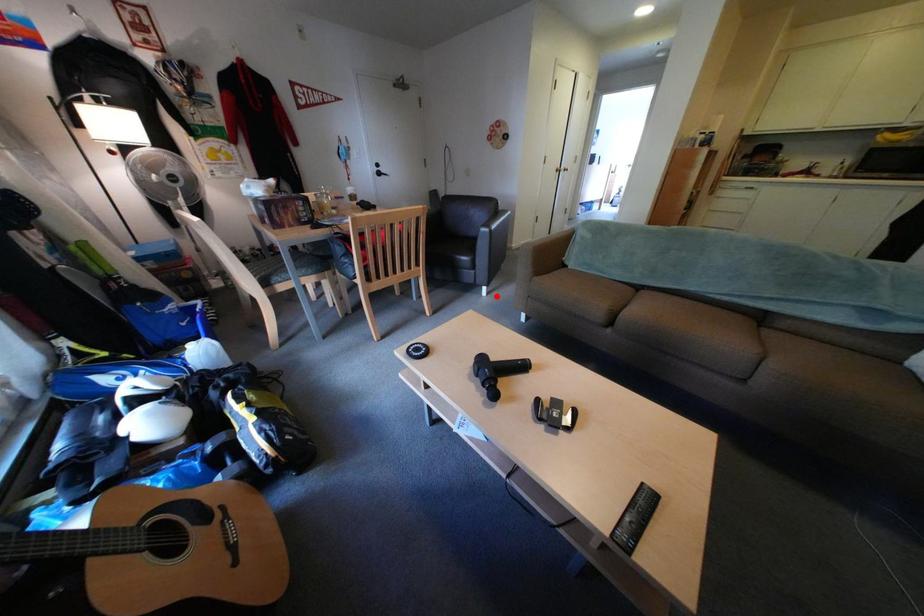
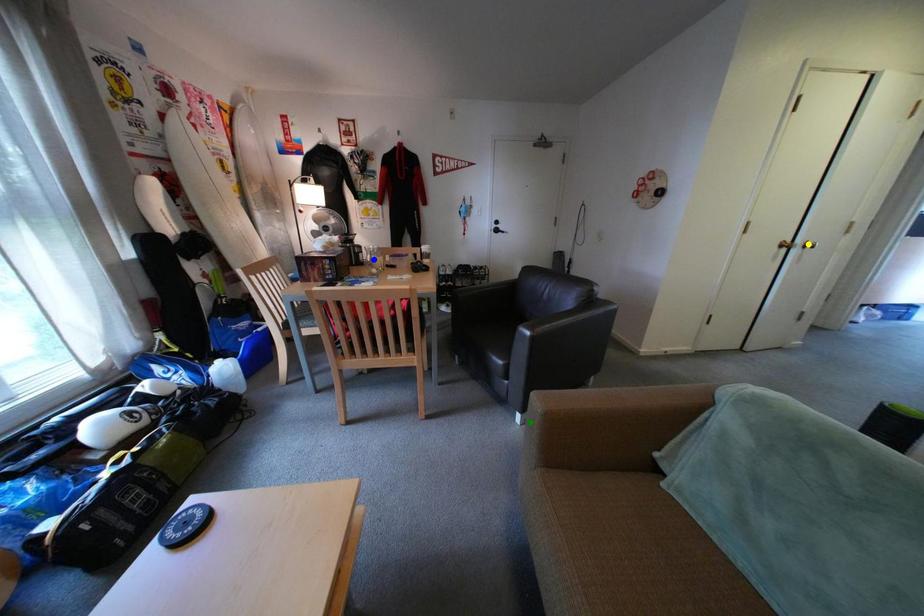
Question: I am providing you with two images of the same scene from different viewpoints. A red point is marked on the first image. You are given multiple points on the second image. Which point in image 2 is actually the same real-world point as the red point in image 1?

Choices:
 (A) yellow point
 (B) blue point
 (C) green point

Answer: (C)